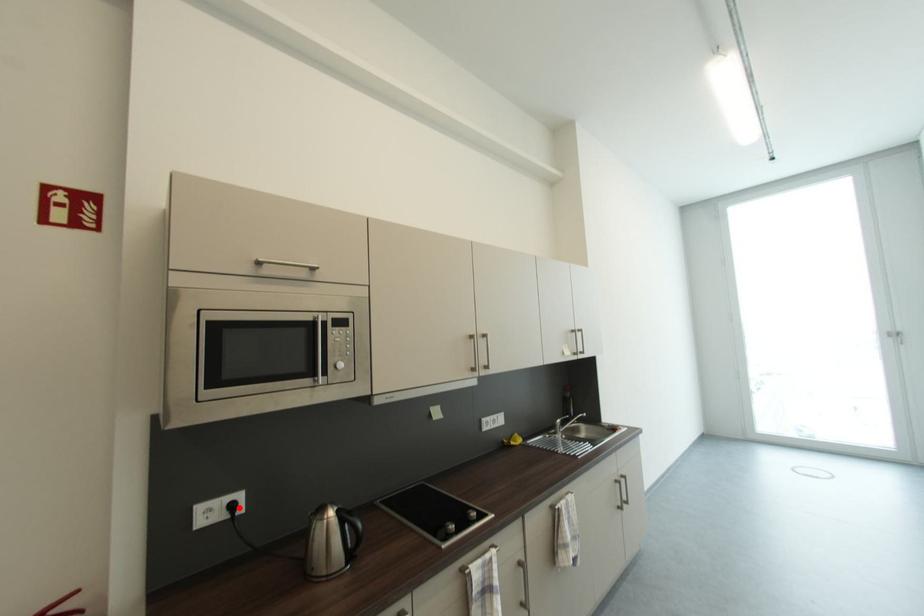
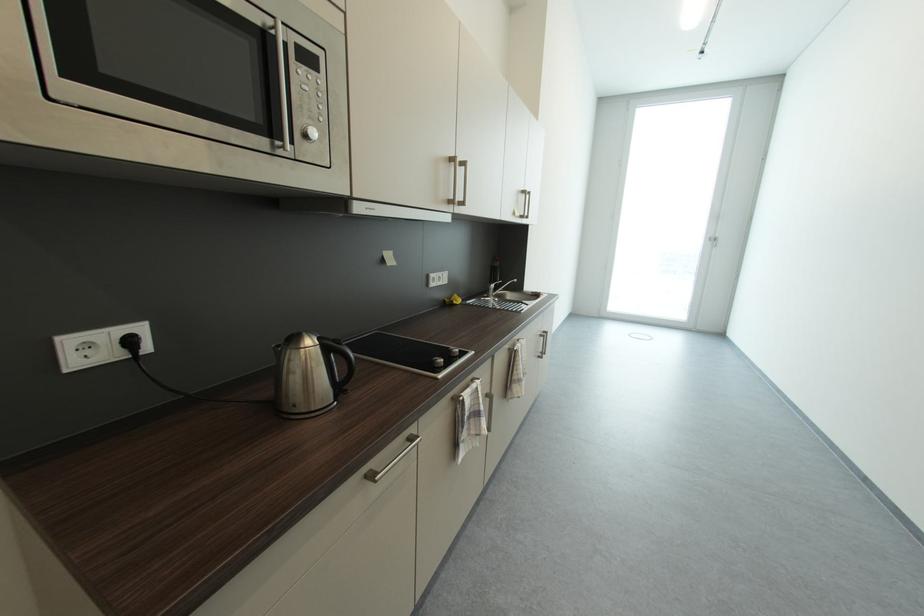
Where in the second image is the point corresponding to the highlighted location from the first image?

(137, 344)